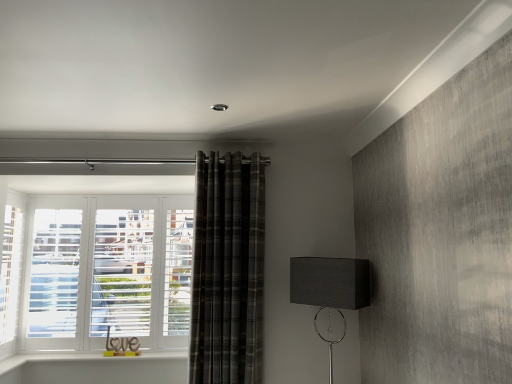
Question: Does plaid fabric curtain at center turn towards matte black rectangular lampshade at lower right?

Choices:
 (A) no
 (B) yes

Answer: (A)

Question: Are plaid fabric curtain at center and matte black rectangular lampshade at lower right located far from each other?

Choices:
 (A) yes
 (B) no

Answer: (B)

Question: Is plaid fabric curtain at center further to the viewer compared to matte black rectangular lampshade at lower right?

Choices:
 (A) yes
 (B) no

Answer: (A)

Question: Is plaid fabric curtain at center outside matte black rectangular lampshade at lower right?

Choices:
 (A) yes
 (B) no

Answer: (A)

Question: Is matte black rectangular lampshade at lower right located within plaid fabric curtain at center?

Choices:
 (A) yes
 (B) no

Answer: (B)

Question: Considering the relative sizes of plaid fabric curtain at center and matte black rectangular lampshade at lower right in the image provided, is plaid fabric curtain at center wider than matte black rectangular lampshade at lower right?

Choices:
 (A) yes
 (B) no

Answer: (B)

Question: Considering the relative sizes of matte black rectangular lampshade at lower right and plaid fabric curtain at center in the image provided, is matte black rectangular lampshade at lower right bigger than plaid fabric curtain at center?

Choices:
 (A) yes
 (B) no

Answer: (B)

Question: Does matte black rectangular lampshade at lower right turn towards plaid fabric curtain at center?

Choices:
 (A) no
 (B) yes

Answer: (A)

Question: Would you say matte black rectangular lampshade at lower right contains plaid fabric curtain at center?

Choices:
 (A) yes
 (B) no

Answer: (B)

Question: From a real-world perspective, is matte black rectangular lampshade at lower right positioned over plaid fabric curtain at center based on gravity?

Choices:
 (A) no
 (B) yes

Answer: (A)

Question: From the image's perspective, is matte black rectangular lampshade at lower right below plaid fabric curtain at center?

Choices:
 (A) no
 (B) yes

Answer: (B)

Question: Can you confirm if matte black rectangular lampshade at lower right is shorter than plaid fabric curtain at center?

Choices:
 (A) yes
 (B) no

Answer: (A)

Question: In the image, is plaid fabric curtain at center on the left side or the right side of matte black rectangular lampshade at lower right?

Choices:
 (A) right
 (B) left

Answer: (B)